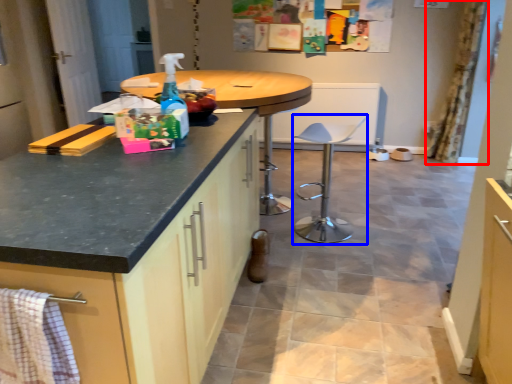
Question: Which of the following is the closest to the observer, curtain (highlighted by a red box) or swivel chair (highlighted by a blue box)?

Choices:
 (A) curtain
 (B) swivel chair

Answer: (B)